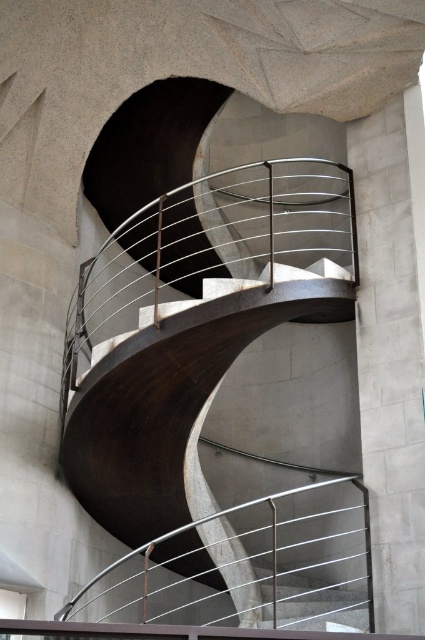
Does satin silver metal stair at center lie behind satin silver metal stairs at center?

No, it is in front of satin silver metal stairs at center.

Between satin silver metal stair at center and satin silver metal stairs at center, which one appears on the right side from the viewer's perspective?

satin silver metal stair at center is more to the right.

Between point (376, 376) and point (283, 625), which one is positioned behind?

Point (376, 376)

Find the location of a particular element. satin silver metal stair at center is located at coordinates (391, 349).